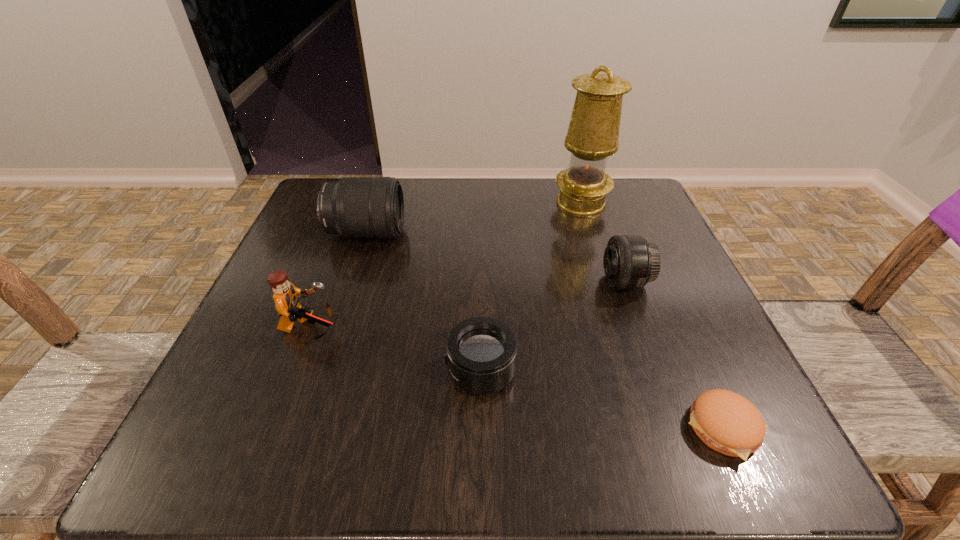
Image resolution: width=960 pixels, height=540 pixels. In the image, there is a desktop. What are the coordinates of `free region at the far edge` in the screenshot? It's located at (565, 222).

In the image, there is a desktop. Where is `vacant space at the near edge`? vacant space at the near edge is located at coordinates (493, 436).

Locate an element on the screen. The width and height of the screenshot is (960, 540). free space at the left edge is located at coordinates (257, 306).

I want to click on free space at the right edge, so click(696, 342).

The image size is (960, 540). Identify the location of vacant space at the far left corner of the desktop. (315, 202).

Image resolution: width=960 pixels, height=540 pixels. In the image, there is a desktop. What are the coordinates of `vacant space at the near right corner` in the screenshot? It's located at (679, 440).

Where is `unoccupied area between the oil lamp and the shortest object`? This screenshot has width=960, height=540. unoccupied area between the oil lamp and the shortest object is located at coordinates (653, 315).

Identify the location of free spot between the second shortest object and the patty. (603, 400).

The width and height of the screenshot is (960, 540). Identify the location of free area in between the farthest telephoto lens and the second telephoto lens from right to left. (423, 302).

This screenshot has width=960, height=540. What are the coordinates of `vacant area that lies between the patty and the fourth nearest object` in the screenshot? It's located at (675, 355).